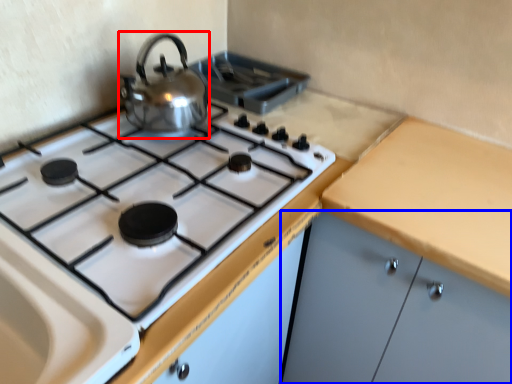
Question: Among these objects, which one is nearest to the camera, kitchen appliance (highlighted by a red box) or cabinetry (highlighted by a blue box)?

Choices:
 (A) kitchen appliance
 (B) cabinetry

Answer: (B)